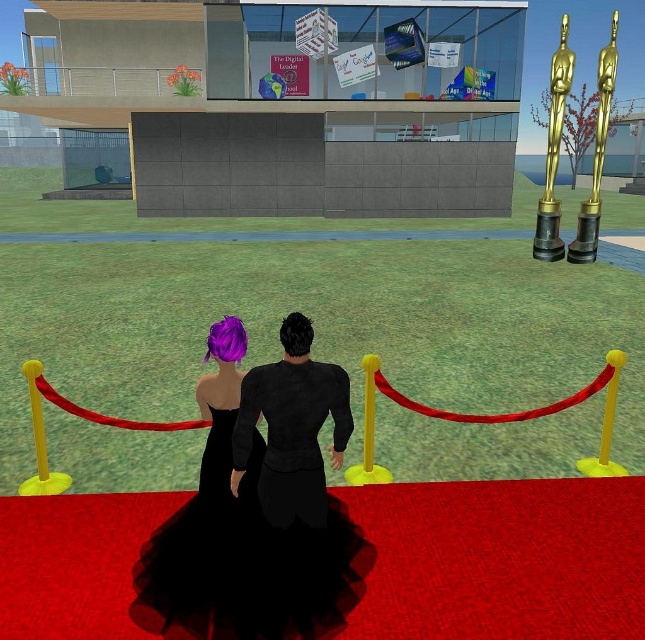
You are a photographer at the event and want to capture both the black velvet suit at center and the shiny purple hair at center in the same frame. Can you do this without moving your camera?

The black velvet suit at center is positioned over the shiny purple hair at center, so they are vertically aligned. Since they are both at the center, you can capture both in the same frame without moving the camera.

You are a photographer at the event and need to capture both the black tulle dress at center and the black velvet suit at center in a single frame. Which clothing item will have more visible lower hem detail in the photo?

The black tulle dress at center is shorter than the black velvet suit at center, so the lower hem detail of the black tulle dress at center will be more visible in the photo.

You are a photographer at the event and need to position yourself so that both the black velvet suit at center and the shiny purple hair at center are in frame. Which object should you place closer to the left side of your camera viewfinder to ensure both are visible?

You should place the shiny purple hair at center closer to the left side of your camera viewfinder because the black velvet suit at center is to the right of the shiny purple hair at center. This arrangement will ensure both are visible in the frame.